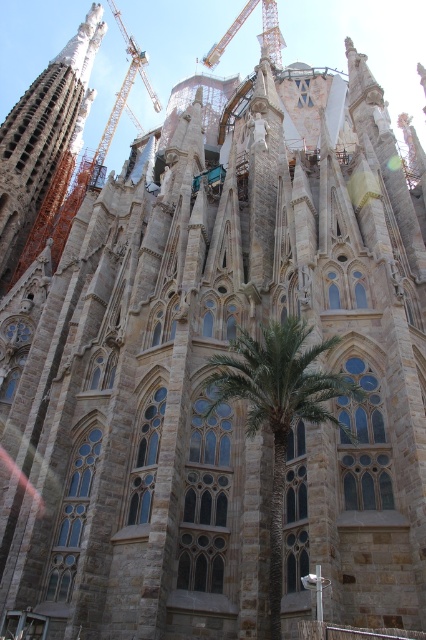
You are standing in front of the cathedral and want to take a photo that includes both the green leafy palm tree at center and the stone tower at center. Which one of these two objects appears taller in the photo?

The stone tower at center appears taller than the green leafy palm tree at center in the photo because the green leafy palm tree at center has a lesser height compared to the stone tower at center.

You are an architect visiting the cathedral and notice the stone tower at center and the metallic construction crane at upper center. Which one appears to be larger in size?

The metallic construction crane at upper center is larger in size compared to the stone tower at center.